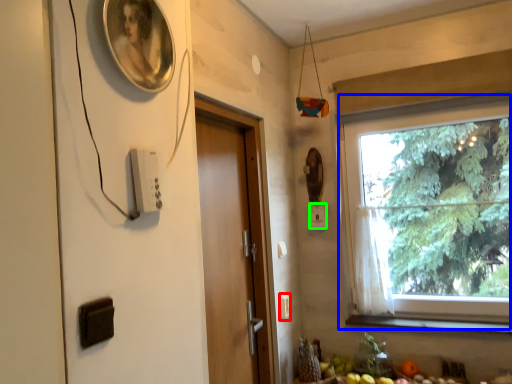
Question: Considering the real-world distances, which object is farthest from light switch (highlighted by a red box)? window (highlighted by a blue box) or light switch (highlighted by a green box)?

Choices:
 (A) window
 (B) light switch

Answer: (A)